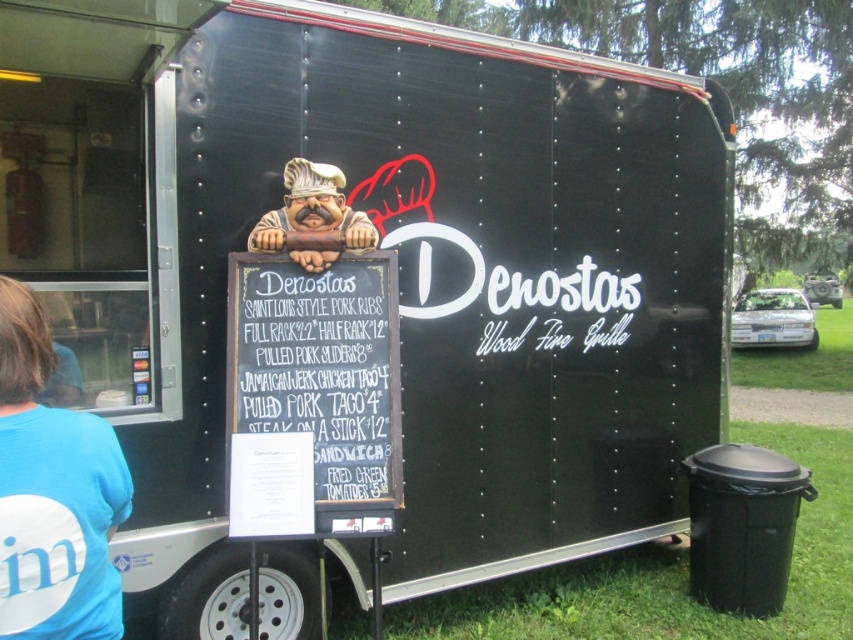
Question: Among these objects, which one is farthest from the camera?

Choices:
 (A) blue fabric shirt at left
 (B) black chalkboard at center

Answer: (B)

Question: Does black chalkboard at center appear on the right side of blue fabric shirt at left?

Choices:
 (A) yes
 (B) no

Answer: (A)

Question: Which point appears closest to the camera in this image?

Choices:
 (A) (303, 182)
 (B) (12, 448)
 (C) (375, 252)

Answer: (B)

Question: Is black chalkboard at center to the right of matte plastic chef at center from the viewer's perspective?

Choices:
 (A) yes
 (B) no

Answer: (A)

Question: Does black chalkboard at center have a smaller size compared to blue fabric shirt at left?

Choices:
 (A) yes
 (B) no

Answer: (B)

Question: Among these points, which one is nearest to the camera?

Choices:
 (A) (30, 307)
 (B) (303, 177)
 (C) (369, 392)

Answer: (A)